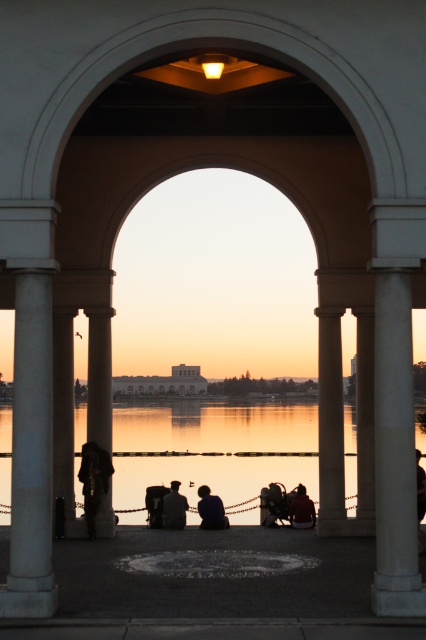
You are standing behind the two jackets mentioned and want to pick up the matte black jacket at center without disturbing the dark gray fabric jacket at center. Is this possible based on their positions?

The matte black jacket at center is positioned under the dark gray fabric jacket at center, so you can reach under the dark gray fabric jacket at center to pick up the matte black jacket at center without disturbing it.

You are standing in front of the arches and want to place a 1.5 meter wide decorative panel between the white marble column at right and the matte black jacket at center. Can the panel fit between them?

The white marble column at right is wider than the matte black jacket at center. However, the exact distance between them isn not specified in the provided information. Therefore, it is uncertain whether the 1.5 meter wide panel can fit between them based solely on the given data.